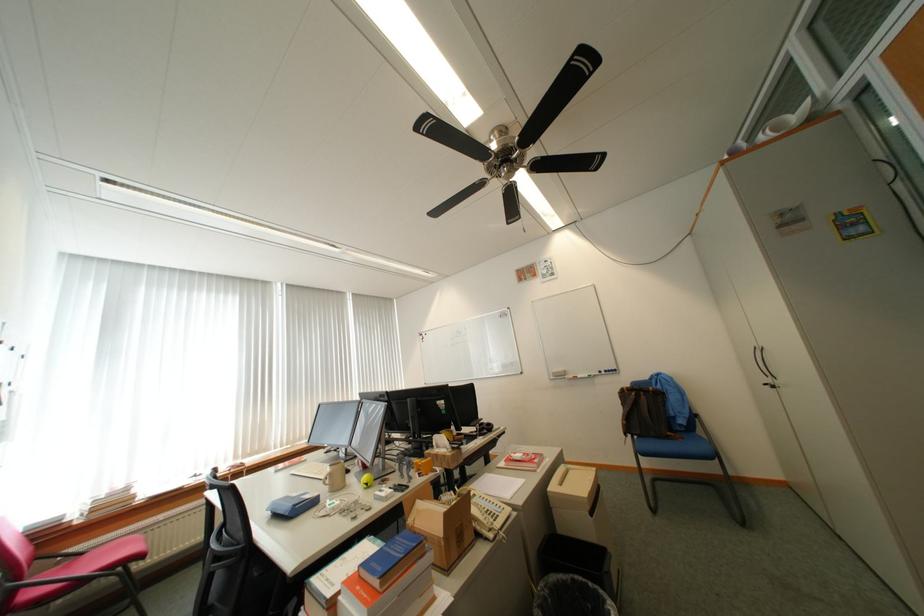
Locate an element on the screen. brown backpack handle is located at coordinates (643, 413).